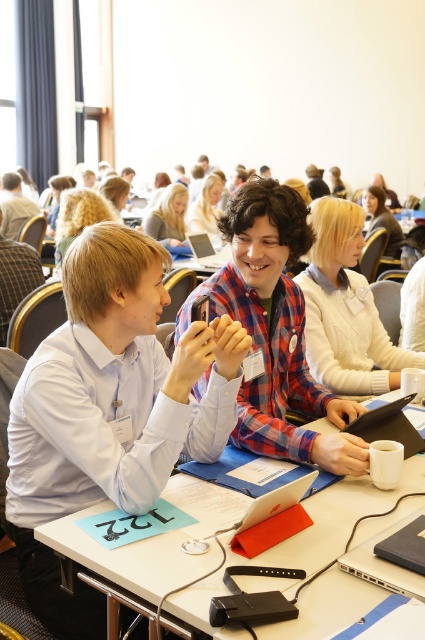
Is point (348, 282) farther from camera compared to point (2, 282)?

That is False.

Which of these two, white knit sweater at center or matte white shirt at center, stands taller?

white knit sweater at center

Find the location of a particular element. This screenshot has width=425, height=640. white knit sweater at center is located at coordinates (345, 308).

Find the location of `white knit sweater at center`. white knit sweater at center is located at coordinates (345, 308).

Is light blue shirt at center taller than silver metallic laptop at center?

Indeed, light blue shirt at center has a greater height compared to silver metallic laptop at center.

You are a GUI agent. You are given a task and a screenshot of the screen. Output one action in this format:
    pyautogui.click(x=<x>, y=<y>)
    Task: Click on the light blue shirt at center
    
    Given the screenshot: What is the action you would take?
    pyautogui.click(x=110, y=408)

Find the location of `light blue shirt at center`. light blue shirt at center is located at coordinates (110, 408).

Between white plastic table at center and matte white shirt at center, which one appears on the left side from the viewer's perspective?

matte white shirt at center is more to the left.

Which is behind, point (176, 496) or point (5, 337)?

Positioned behind is point (5, 337).

I want to click on white plastic table at center, so click(x=153, y=540).